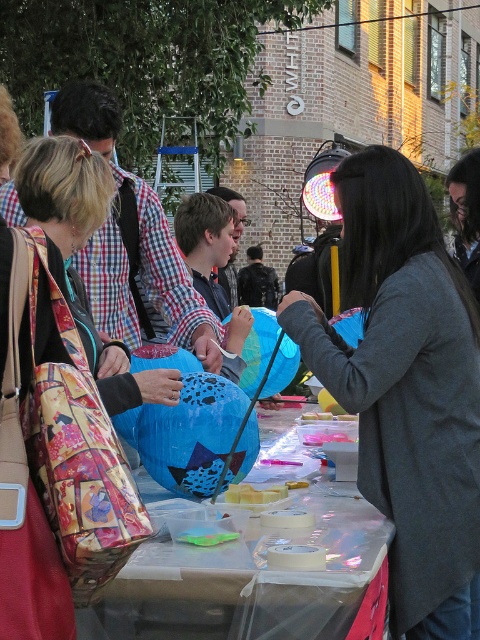
Question: Observing the image, what is the correct spatial positioning of printed fabric bag at left in reference to floral fabric bag at left?

Choices:
 (A) left
 (B) right

Answer: (B)

Question: Can you confirm if gray fabric coat at center is bigger than blue glossy balloon at center?

Choices:
 (A) no
 (B) yes

Answer: (A)

Question: Which of the following is the farthest from the observer?

Choices:
 (A) (300, 634)
 (B) (44, 164)

Answer: (B)

Question: Based on their relative distances, which object is farther from the floral fabric bag at left?

Choices:
 (A) blue glossy balloon at center
 (B) translucent plastic table at center
 (C) printed fabric bag at left

Answer: (A)

Question: Is printed fabric bag at left to the left of floral fabric bag at left from the viewer's perspective?

Choices:
 (A) yes
 (B) no

Answer: (B)

Question: Which object is closer to the camera taking this photo?

Choices:
 (A) blue glossy balloon at center
 (B) gray fabric coat at center

Answer: (B)